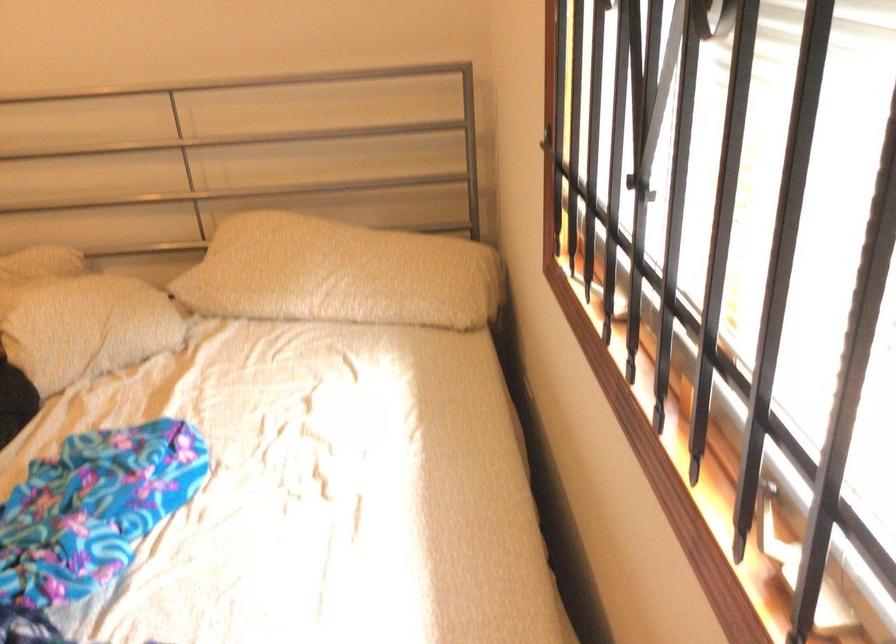
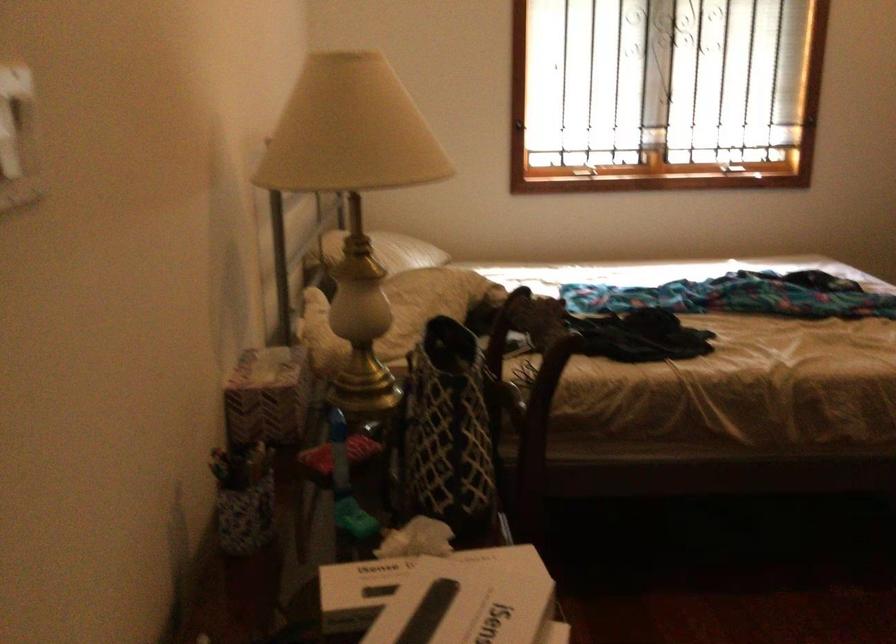
Question: I am providing you with two images of the same scene from different viewpoints. After the viewpoint changes to image2, which objects are now occluded?

Choices:
 (A) white pillow
 (B) window latch
 (C) white cardboard box
 (D) none of these

Answer: (D)